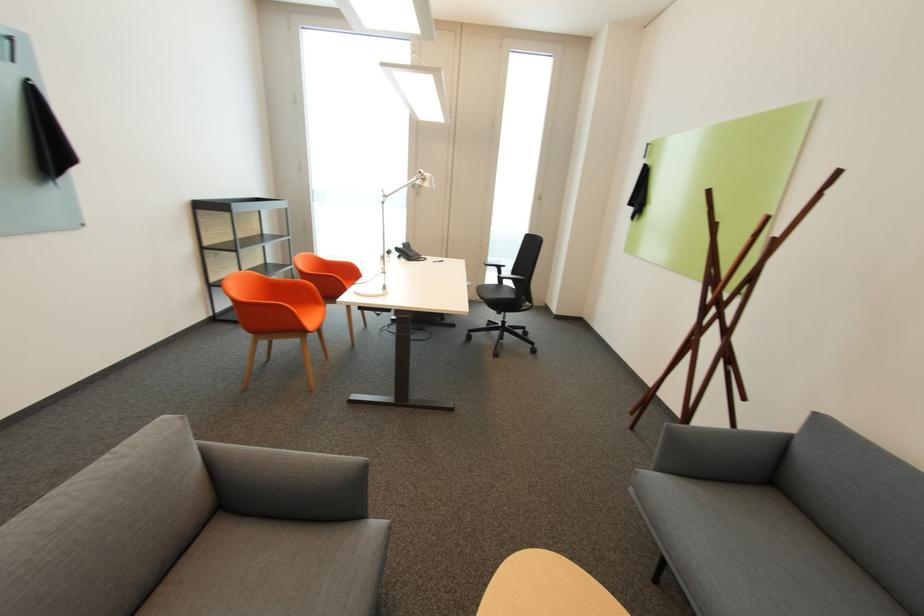
In order to click on black chair armrest in this screenshot , I will do `click(495, 262)`.